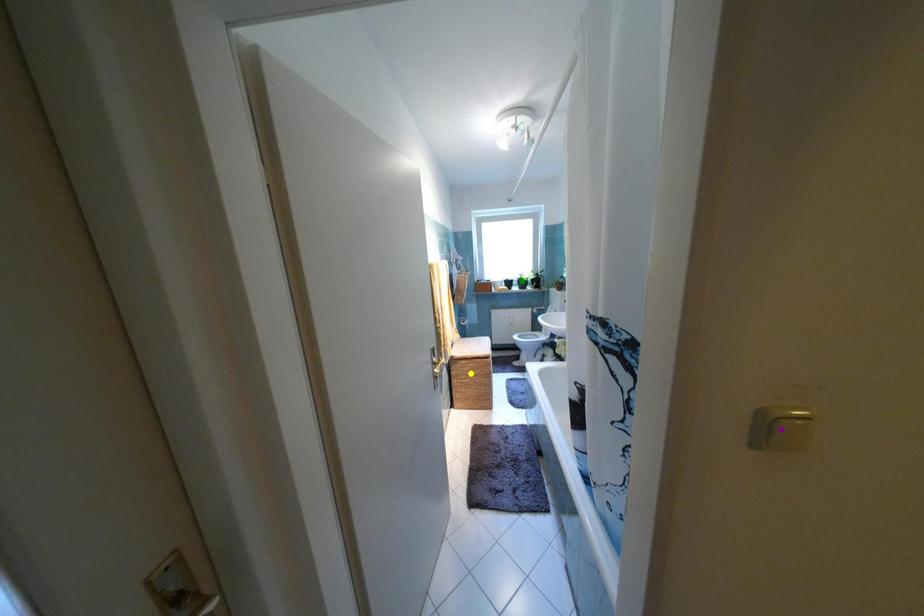
From the picture: Order these from nearest to farthest:
- green point
- yellow point
- purple point

purple point → yellow point → green point